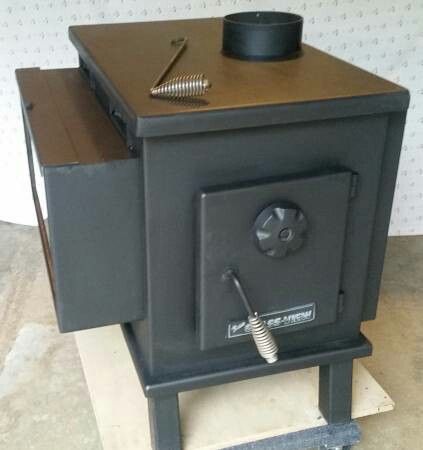
The width and height of the screenshot is (423, 450). What are the coordinates of `wood stove` in the screenshot? It's located at (284, 292).